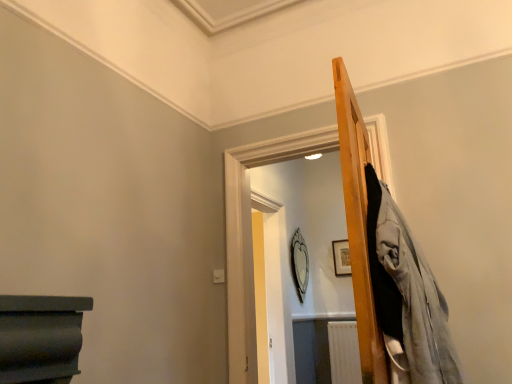
Question: Is wooden picture frame at upper right positioned beyond the bounds of silver metallic mirror at center?

Choices:
 (A) no
 (B) yes

Answer: (B)

Question: Is wooden picture frame at upper right touching silver metallic mirror at center?

Choices:
 (A) yes
 (B) no

Answer: (B)

Question: From the image's perspective, is wooden picture frame at upper right above silver metallic mirror at center?

Choices:
 (A) no
 (B) yes

Answer: (B)

Question: Are wooden picture frame at upper right and silver metallic mirror at center located far from each other?

Choices:
 (A) no
 (B) yes

Answer: (A)

Question: Can you confirm if wooden picture frame at upper right is positioned to the left of silver metallic mirror at center?

Choices:
 (A) yes
 (B) no

Answer: (B)

Question: Does wooden picture frame at upper right have a larger size compared to silver metallic mirror at center?

Choices:
 (A) no
 (B) yes

Answer: (A)

Question: Is silver metallic mirror at center wider than wooden picture frame at upper right?

Choices:
 (A) yes
 (B) no

Answer: (A)

Question: Would you say silver metallic mirror at center is a long distance from wooden picture frame at upper right?

Choices:
 (A) no
 (B) yes

Answer: (A)

Question: Considering the relative positions of silver metallic mirror at center and wooden picture frame at upper right in the image provided, is silver metallic mirror at center behind wooden picture frame at upper right?

Choices:
 (A) yes
 (B) no

Answer: (B)

Question: From a real-world perspective, is silver metallic mirror at center positioned over wooden picture frame at upper right based on gravity?

Choices:
 (A) no
 (B) yes

Answer: (A)

Question: Does silver metallic mirror at center touch wooden picture frame at upper right?

Choices:
 (A) no
 (B) yes

Answer: (A)

Question: Is wooden picture frame at upper right at the back of silver metallic mirror at center?

Choices:
 (A) yes
 (B) no

Answer: (B)

Question: From the image's perspective, is silver metallic mirror at center above or below wooden picture frame at upper right?

Choices:
 (A) above
 (B) below

Answer: (B)